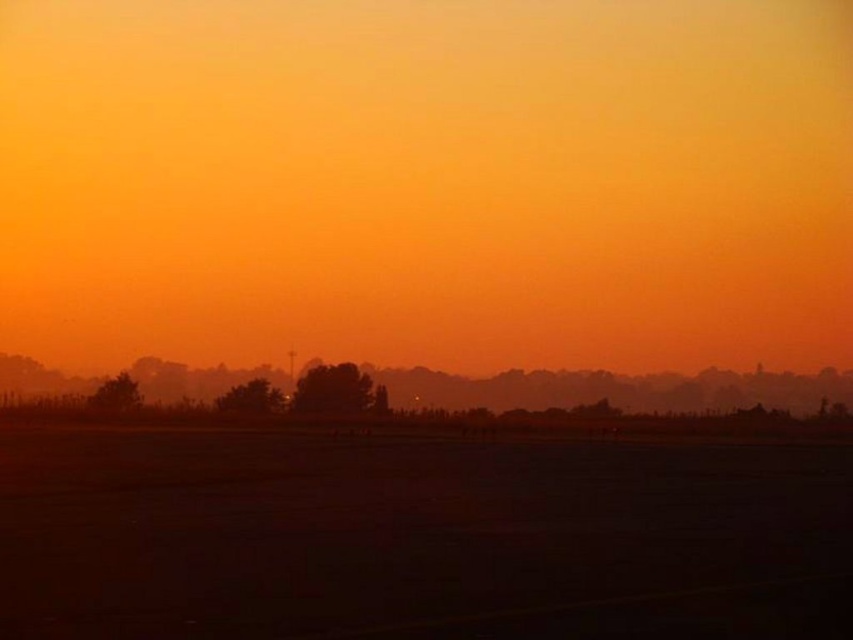
You are standing in the middle of the dark matte tarmac at center and looking towards the foggy horizon at center. Which object is closer to your eyes?

The dark matte tarmac at center is closer to your eyes because it has a lesser height compared to the foggy horizon at center.